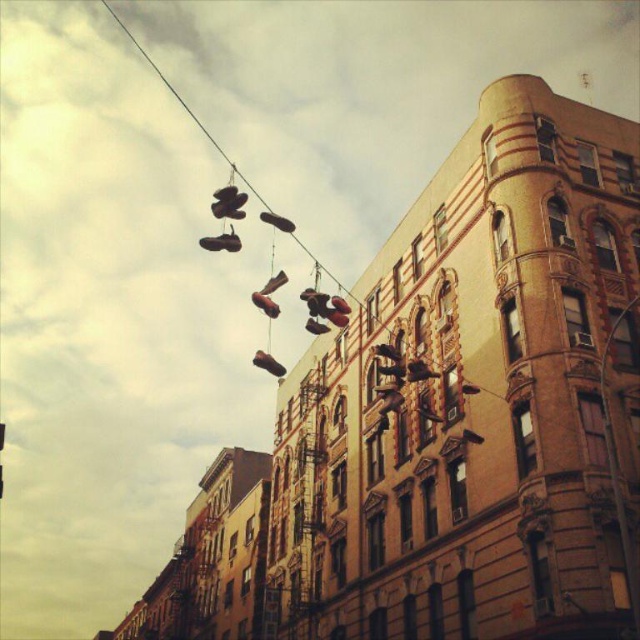
Does point (216, 243) lie behind point (257, 353)?

No, it is in front of (257, 353).

Between matte brown shoe at upper center and shiny brown shoe at center, which one appears on the left side from the viewer's perspective?

matte brown shoe at upper center

Describe the element at coordinates (221, 243) in the screenshot. I see `matte brown shoe at upper center` at that location.

The width and height of the screenshot is (640, 640). I want to click on matte brown shoe at upper center, so click(x=221, y=243).

Can you confirm if matte brown shoe at upper center is positioned below shiny leather shoe at center?

No, matte brown shoe at upper center is not below shiny leather shoe at center.

Can you confirm if matte brown shoe at upper center is smaller than shiny leather shoe at center?

No.

Locate an element on the screen. The width and height of the screenshot is (640, 640). matte brown shoe at upper center is located at coordinates (221, 243).

Where is `matte brown shoe at upper center`? matte brown shoe at upper center is located at coordinates (221, 243).

Can you confirm if shiny brown shoe at center is bigger than leather shoe at center?

Actually, shiny brown shoe at center might be smaller than leather shoe at center.

Who is more forward, [266,355] or [285,220]?

Point [266,355] is in front.

Who is more distant from viewer, (266,358) or (275,221)?

The point (266,358) is behind.

At what (x,y) coordinates should I click in order to perform the action: click on shiny brown shoe at center. Please return your answer as a coordinate pair (x, y). Looking at the image, I should click on (268, 364).